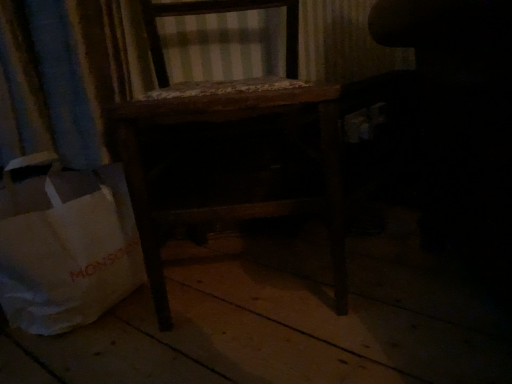
Question: Is white paper bag at lower left outside of wooden chair at center?

Choices:
 (A) no
 (B) yes

Answer: (B)

Question: Can you confirm if white paper bag at lower left is wider than wooden chair at center?

Choices:
 (A) no
 (B) yes

Answer: (A)

Question: Is white paper bag at lower left closer to the viewer compared to wooden chair at center?

Choices:
 (A) no
 (B) yes

Answer: (A)

Question: Is white paper bag at lower left next to wooden chair at center and touching it?

Choices:
 (A) no
 (B) yes

Answer: (A)

Question: Is white paper bag at lower left looking in the opposite direction of wooden chair at center?

Choices:
 (A) no
 (B) yes

Answer: (A)

Question: Can you confirm if white paper bag at lower left is bigger than wooden chair at center?

Choices:
 (A) yes
 (B) no

Answer: (B)

Question: From the image's perspective, would you say dark fabric swivel chair at right is positioned over wooden chair at center?

Choices:
 (A) no
 (B) yes

Answer: (B)

Question: Is dark fabric swivel chair at right not inside wooden chair at center?

Choices:
 (A) no
 (B) yes

Answer: (B)

Question: From a real-world perspective, is dark fabric swivel chair at right positioned under wooden chair at center based on gravity?

Choices:
 (A) yes
 (B) no

Answer: (B)

Question: Does dark fabric swivel chair at right have a smaller size compared to wooden chair at center?

Choices:
 (A) no
 (B) yes

Answer: (A)

Question: Could wooden chair at center be considered to be inside dark fabric swivel chair at right?

Choices:
 (A) yes
 (B) no

Answer: (B)

Question: Is dark fabric swivel chair at right facing away from wooden chair at center?

Choices:
 (A) no
 (B) yes

Answer: (A)

Question: Does wooden chair at center turn towards white paper bag at lower left?

Choices:
 (A) no
 (B) yes

Answer: (A)